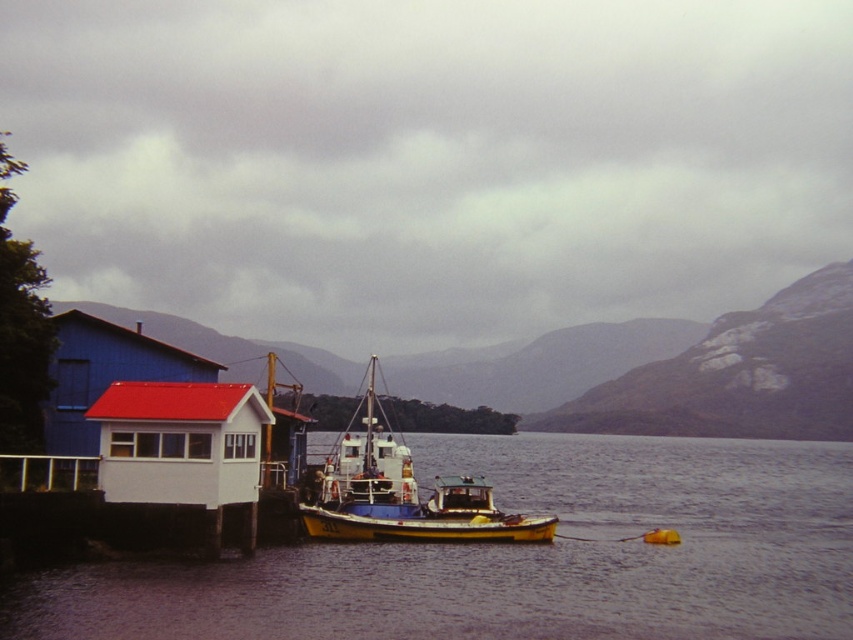
Question: Which point is farther to the camera?

Choices:
 (A) smooth water at center
 (B) yellow matte boat at center

Answer: (B)

Question: Does smooth water at center have a lesser width compared to yellow matte boat at center?

Choices:
 (A) yes
 (B) no

Answer: (B)

Question: Can you confirm if smooth water at center is smaller than white matte building at left?

Choices:
 (A) yes
 (B) no

Answer: (A)

Question: Considering the real-world distances, which object is farthest from the white matte building at left?

Choices:
 (A) yellow matte boat at center
 (B) smooth water at center

Answer: (B)

Question: Which of these objects is positioned farthest from the yellow matte boat at center?

Choices:
 (A) white matte building at left
 (B) smooth water at center

Answer: (A)

Question: Can you confirm if smooth water at center is wider than yellow matte boat at center?

Choices:
 (A) no
 (B) yes

Answer: (B)